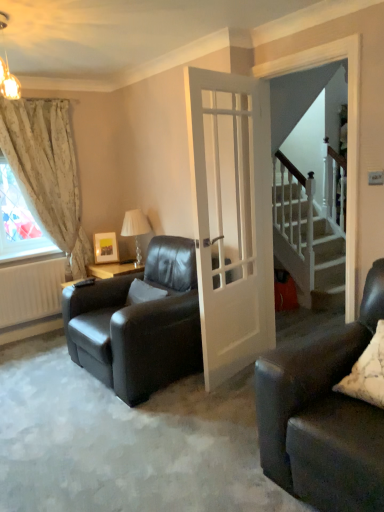
Question: Is matte wooden picture frame at upper left at the right side of white soft pillow at center, positioned as the second pillow in right-to-left order?

Choices:
 (A) yes
 (B) no

Answer: (B)

Question: Is matte wooden picture frame at upper left placed right next to white soft pillow at center, placed as the second pillow when sorted from front to back?

Choices:
 (A) no
 (B) yes

Answer: (A)

Question: Is matte wooden picture frame at upper left outside white soft pillow at center, placed as the second pillow when sorted from front to back?

Choices:
 (A) no
 (B) yes

Answer: (B)

Question: Considering the relative positions of matte wooden picture frame at upper left and white soft pillow at center, placed as the second pillow when sorted from front to back, in the image provided, is matte wooden picture frame at upper left behind white soft pillow at center, placed as the second pillow when sorted from front to back,?

Choices:
 (A) yes
 (B) no

Answer: (A)

Question: Is matte wooden picture frame at upper left at the left side of white soft pillow at center, the first pillow when ordered from back to front?

Choices:
 (A) no
 (B) yes

Answer: (B)

Question: Is matte wooden picture frame at upper left taller than white soft pillow at center, the first pillow when ordered from back to front?

Choices:
 (A) no
 (B) yes

Answer: (B)

Question: Can you confirm if matte gold chandelier at upper left is bigger than white soft pillow at center, the 1th pillow positioned from the left?

Choices:
 (A) no
 (B) yes

Answer: (B)

Question: Could you tell me if matte gold chandelier at upper left is turned towards white soft pillow at center, positioned as the second pillow in right-to-left order?

Choices:
 (A) no
 (B) yes

Answer: (A)

Question: Is the position of matte gold chandelier at upper left more distant than that of white soft pillow at center, positioned as the second pillow in right-to-left order?

Choices:
 (A) yes
 (B) no

Answer: (B)

Question: From a real-world perspective, is matte gold chandelier at upper left positioned over white soft pillow at center, the first pillow when ordered from back to front, based on gravity?

Choices:
 (A) no
 (B) yes

Answer: (B)

Question: Is matte gold chandelier at upper left not inside white soft pillow at center, the 1th pillow positioned from the left?

Choices:
 (A) no
 (B) yes

Answer: (B)

Question: From the image's perspective, is matte gold chandelier at upper left located beneath white soft pillow at center, positioned as the second pillow in right-to-left order?

Choices:
 (A) yes
 (B) no

Answer: (B)

Question: Is the position of floral fabric curtain at left less distant than that of white matte radiator at lower left?

Choices:
 (A) no
 (B) yes

Answer: (B)